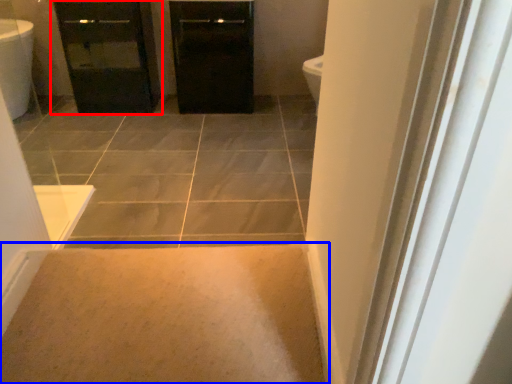
Question: Which object is further to the camera taking this photo, bathroom cabinet (highlighted by a red box) or plain (highlighted by a blue box)?

Choices:
 (A) bathroom cabinet
 (B) plain

Answer: (A)